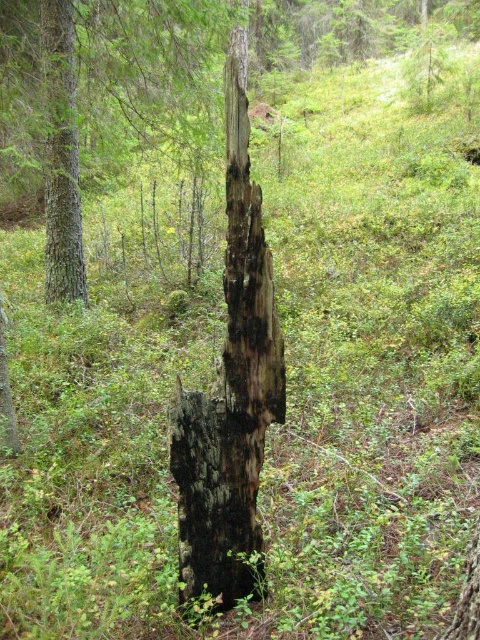
Is charcoal wood stump at center positioned at the back of smooth brown tree trunk at left?

No, it is not.

Is charcoal wood stump at center shorter than smooth brown tree trunk at left?

Yes, charcoal wood stump at center is shorter than smooth brown tree trunk at left.

Is point (230, 394) behind point (46, 186)?

No, (230, 394) is closer to viewer.

You are a GUI agent. You are given a task and a screenshot of the screen. Output one action in this format:
    pyautogui.click(x=<x>, y=<y>)
    Task: Click on the charcoal wood stump at center
    The image size is (480, 640).
    Given the screenshot: What is the action you would take?
    pyautogui.click(x=230, y=388)

Does charred wood stump at center have a lesser height compared to smooth brown tree trunk at left?

Yes, charred wood stump at center is shorter than smooth brown tree trunk at left.

Between point (137, 77) and point (54, 92), which one is positioned in front?

Positioned in front is point (54, 92).

Find the location of `charred wood stump at center`. charred wood stump at center is located at coordinates (94, 104).

Is charred wood stump at center smaller than charcoal wood stump at center?

Actually, charred wood stump at center might be larger than charcoal wood stump at center.

Does charred wood stump at center come behind charcoal wood stump at center?

That is True.

Measure the distance between charred wood stump at center and camera.

charred wood stump at center is 6.95 meters from camera.

You are a GUI agent. You are given a task and a screenshot of the screen. Output one action in this format:
    pyautogui.click(x=<x>, y=<y>)
    Task: Click on the charred wood stump at center
    
    Given the screenshot: What is the action you would take?
    pyautogui.click(x=94, y=104)